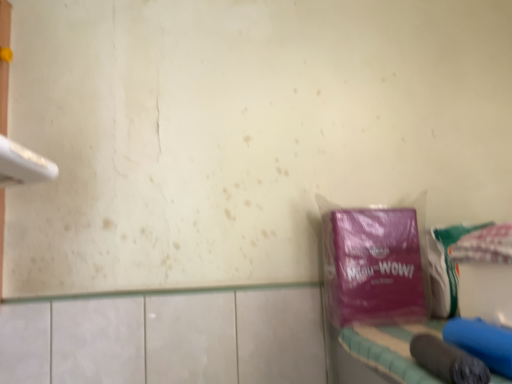
Question: From their relative heights in the image, would you say blue fabric vanity at lower right is taller or shorter than purple matte plastic bag at right?

Choices:
 (A) short
 (B) tall

Answer: (A)

Question: Looking at the image, does blue fabric vanity at lower right seem bigger or smaller compared to purple matte plastic bag at right?

Choices:
 (A) small
 (B) big

Answer: (B)

Question: Looking at their shapes, would you say blue fabric vanity at lower right is wider or thinner than purple matte plastic bag at right?

Choices:
 (A) wide
 (B) thin

Answer: (A)

Question: Would you say purple matte plastic bag at right is inside or outside blue fabric vanity at lower right?

Choices:
 (A) outside
 (B) inside

Answer: (A)

Question: Is point (386, 306) closer or farther from the camera than point (419, 367)?

Choices:
 (A) closer
 (B) farther

Answer: (B)

Question: From the image's perspective, is purple matte plastic bag at right above or below blue fabric vanity at lower right?

Choices:
 (A) above
 (B) below

Answer: (A)

Question: Considering the positions of purple matte plastic bag at right and blue fabric vanity at lower right in the image, is purple matte plastic bag at right bigger or smaller than blue fabric vanity at lower right?

Choices:
 (A) big
 (B) small

Answer: (B)